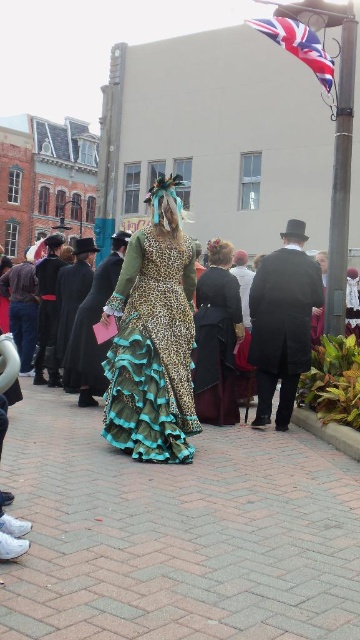
Can you confirm if smooth black coat at center is taller than union jack fabric at upper right?

Yes, smooth black coat at center is taller than union jack fabric at upper right.

Is smooth black coat at center below union jack fabric at upper right?

Indeed, smooth black coat at center is positioned under union jack fabric at upper right.

You are a GUI agent. You are given a task and a screenshot of the screen. Output one action in this format:
    pyautogui.click(x=<x>, y=<y>)
    Task: Click on the smooth black coat at center
    
    Given the screenshot: What is the action you would take?
    pyautogui.click(x=282, y=323)

Between leopard print dress at center and black wool coat at left, which one has less height?

Standing shorter between the two is black wool coat at left.

Describe the element at coordinates (153, 339) in the screenshot. I see `leopard print dress at center` at that location.

Where is `leopard print dress at center`? leopard print dress at center is located at coordinates (153, 339).

Is leopard print dress at center positioned behind matte black coat at left?

That is False.

Which is below, leopard print dress at center or matte black coat at left?

Positioned lower is leopard print dress at center.

Identify the location of leopard print dress at center. This screenshot has height=640, width=360. (153, 339).